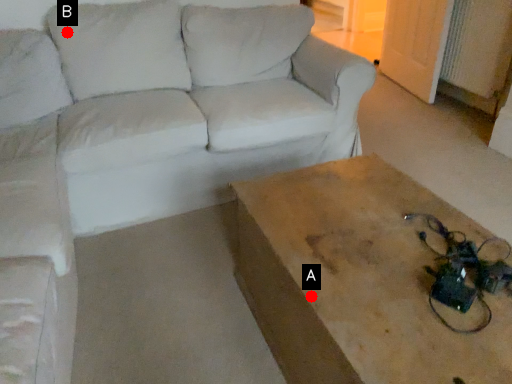
Question: Two points are circled on the image, labeled by A and B beside each circle. Which of the following is the closest to the observer?

Choices:
 (A) A is closer
 (B) B is closer

Answer: (A)